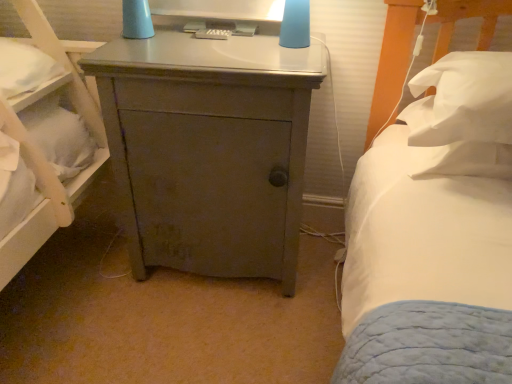
You are a GUI agent. You are given a task and a screenshot of the screen. Output one action in this format:
    pyautogui.click(x=<x>, y=<y>)
    Task: Click on the free space in front of matte gray cabinet at center
    This screenshot has height=384, width=512.
    Given the screenshot: What is the action you would take?
    pyautogui.click(x=198, y=337)